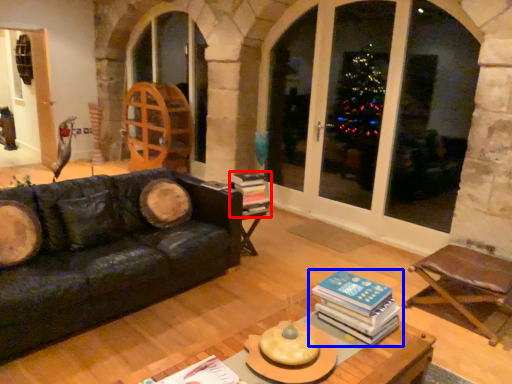
Question: Which of the following is the closest to the observer, book (highlighted by a red box) or book (highlighted by a blue box)?

Choices:
 (A) book
 (B) book

Answer: (B)